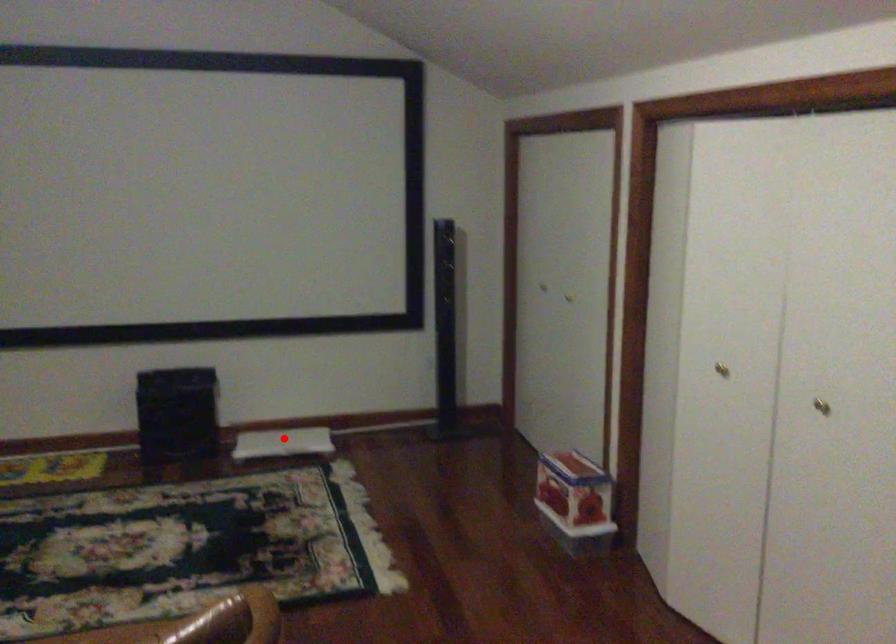
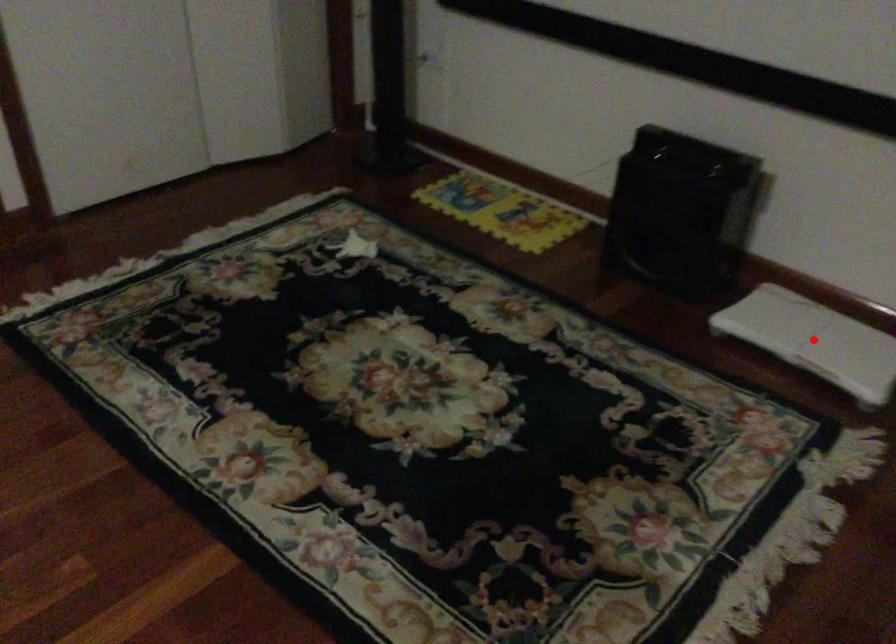
I am providing you with two images of the same scene from different viewpoints. A red point is marked on the first image and another point is marked on the second image. Do the highlighted points in image1 and image2 indicate the same real-world spot?

Yes